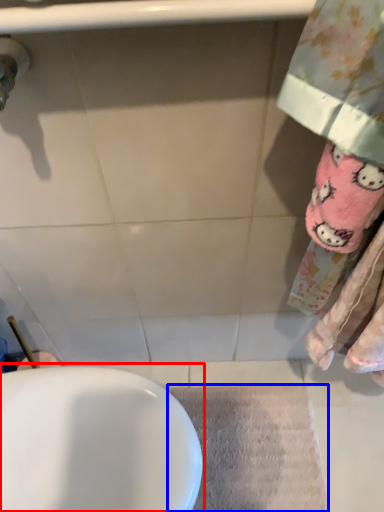
Question: Among these objects, which one is farthest to the camera, sink (highlighted by a red box) or bath mat (highlighted by a blue box)?

Choices:
 (A) sink
 (B) bath mat

Answer: (B)